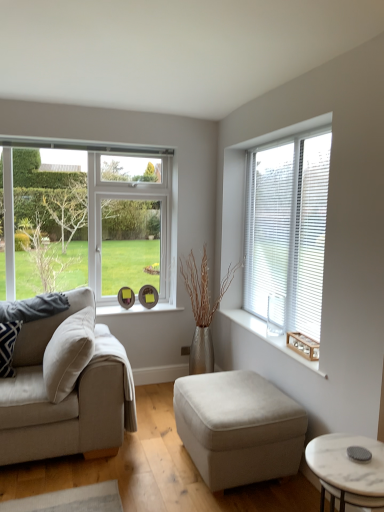
Question: From the image's perspective, is clear glass window at left, marked as the second window in a right-to-left arrangement, under wooden window sill at right?

Choices:
 (A) no
 (B) yes

Answer: (A)

Question: Does clear glass window at left, which appears as the 1th window when viewed from the left, come behind wooden window sill at right?

Choices:
 (A) no
 (B) yes

Answer: (B)

Question: Can you confirm if clear glass window at left, marked as the second window in a right-to-left arrangement, is thinner than wooden window sill at right?

Choices:
 (A) yes
 (B) no

Answer: (A)

Question: Could you tell me if clear glass window at left, marked as the second window in a right-to-left arrangement, is turned towards wooden window sill at right?

Choices:
 (A) no
 (B) yes

Answer: (A)

Question: Is clear glass window at left, marked as the second window in a right-to-left arrangement, closer to camera compared to wooden window sill at right?

Choices:
 (A) no
 (B) yes

Answer: (A)

Question: Is clear glass window at left, which appears as the 1th window when viewed from the left, at the left side of wooden window sill at right?

Choices:
 (A) no
 (B) yes

Answer: (B)

Question: Can you confirm if white marble coffee table at lower right is positioned to the right of patterned fabric pillow at left?

Choices:
 (A) yes
 (B) no

Answer: (A)

Question: Is white marble coffee table at lower right oriented towards patterned fabric pillow at left?

Choices:
 (A) yes
 (B) no

Answer: (B)

Question: Can we say white marble coffee table at lower right lies outside patterned fabric pillow at left?

Choices:
 (A) no
 (B) yes

Answer: (B)

Question: Considering the relative sizes of white marble coffee table at lower right and patterned fabric pillow at left in the image provided, is white marble coffee table at lower right wider than patterned fabric pillow at left?

Choices:
 (A) yes
 (B) no

Answer: (A)

Question: Is white marble coffee table at lower right closer to camera compared to patterned fabric pillow at left?

Choices:
 (A) no
 (B) yes

Answer: (B)

Question: Is white marble coffee table at lower right to the left of patterned fabric pillow at left from the viewer's perspective?

Choices:
 (A) no
 (B) yes

Answer: (A)

Question: Is beige fabric couch at left positioned with its back to white marble coffee table at lower right?

Choices:
 (A) yes
 (B) no

Answer: (B)